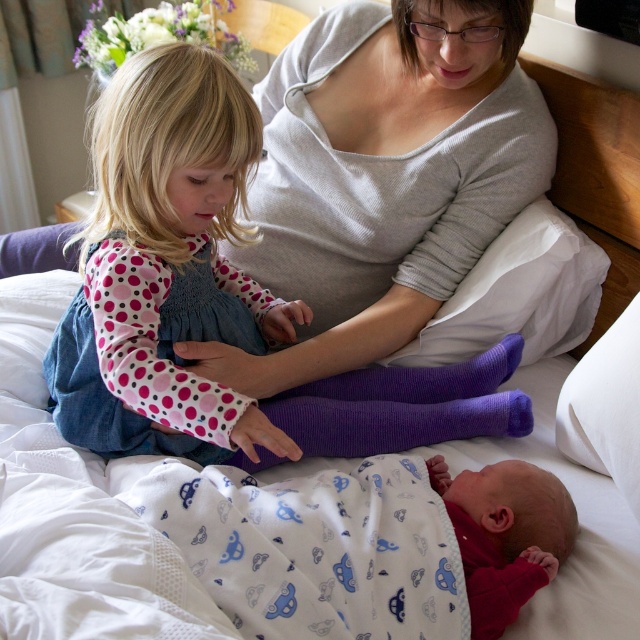
Question: Does matte gray sweater at upper center lie in front of denim dress at upper left?

Choices:
 (A) yes
 (B) no

Answer: (B)

Question: Which object appears farthest from the camera in this image?

Choices:
 (A) matte gray sweater at upper center
 (B) purple ribbed sock at center
 (C) purple knitted sock at center

Answer: (C)

Question: Does denim dress at upper left have a greater width compared to purple knitted sock at center?

Choices:
 (A) yes
 (B) no

Answer: (B)

Question: Considering the real-world distances, which object is farthest from the purple knitted sock at center?

Choices:
 (A) purple ribbed sock at center
 (B) denim dress at upper left

Answer: (B)

Question: Can you confirm if matte gray sweater at upper center is positioned to the left of purple knitted sock at center?

Choices:
 (A) no
 (B) yes

Answer: (B)

Question: Among these points, which one is nearest to the camera?

Choices:
 (A) (480, 68)
 (B) (284, 538)
 (C) (349, 381)

Answer: (B)